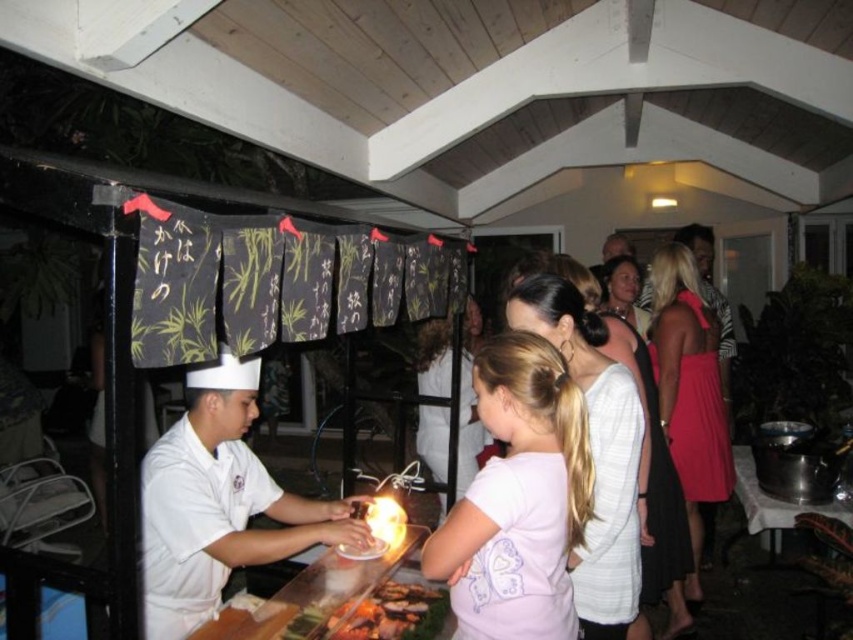
Question: Can you confirm if light pink fabric at center is positioned to the left of light pink fabric dress at center?

Choices:
 (A) yes
 (B) no

Answer: (B)

Question: Which object appears farthest from the camera in this image?

Choices:
 (A) light pink fabric at center
 (B) light pink fabric dress at center
 (C) white uniform at center
 (D) smooth skin face at center

Answer: (D)

Question: Which point appears farthest from the camera in this image?

Choices:
 (A) (643, 326)
 (B) (595, 522)
 (C) (722, 412)
 (D) (194, 500)

Answer: (A)

Question: Is white uniform at center smaller than light pink fabric dress at center?

Choices:
 (A) yes
 (B) no

Answer: (A)

Question: Where is light pink fabric dress at center located in relation to grilled meat at center in the image?

Choices:
 (A) below
 (B) above

Answer: (B)

Question: Which point is closer to the camera taking this photo?

Choices:
 (A) (419, 602)
 (B) (616, 604)
 (C) (318, 520)

Answer: (B)